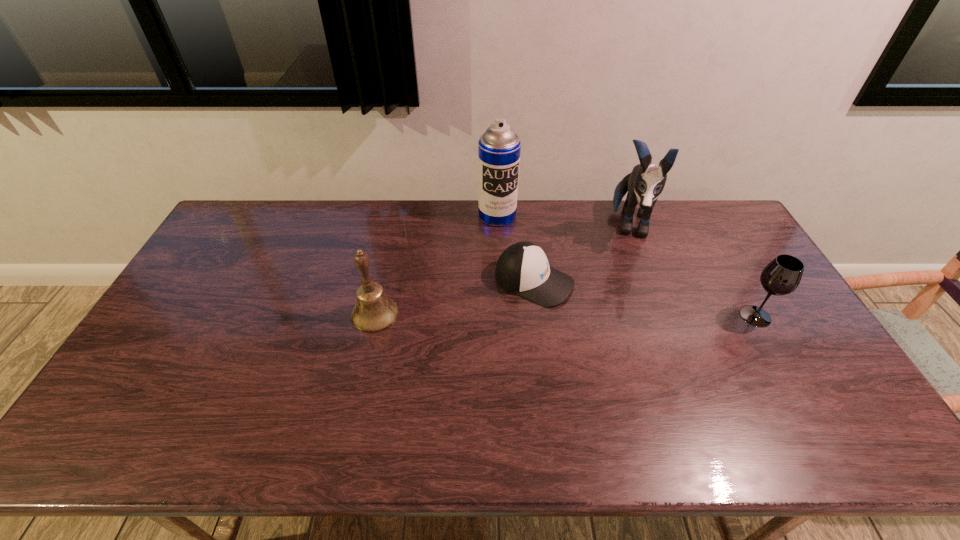
Locate an element on the screen. Image resolution: width=960 pixels, height=540 pixels. vacant space on the desktop that is between the third shortest object and the second shortest object and is positioned on the label side of the aerosol can is located at coordinates (527, 315).

Where is `free spot on the desktop that is between the leftmost object and the wineglass and is positioned on the front panel of the shortest object`? The width and height of the screenshot is (960, 540). free spot on the desktop that is between the leftmost object and the wineglass and is positioned on the front panel of the shortest object is located at coordinates (613, 315).

Find the location of a particular element. free space on the desktop that is between the third tallest object and the fourth tallest object and is positioned on the front-facing side of the puppy is located at coordinates (621, 315).